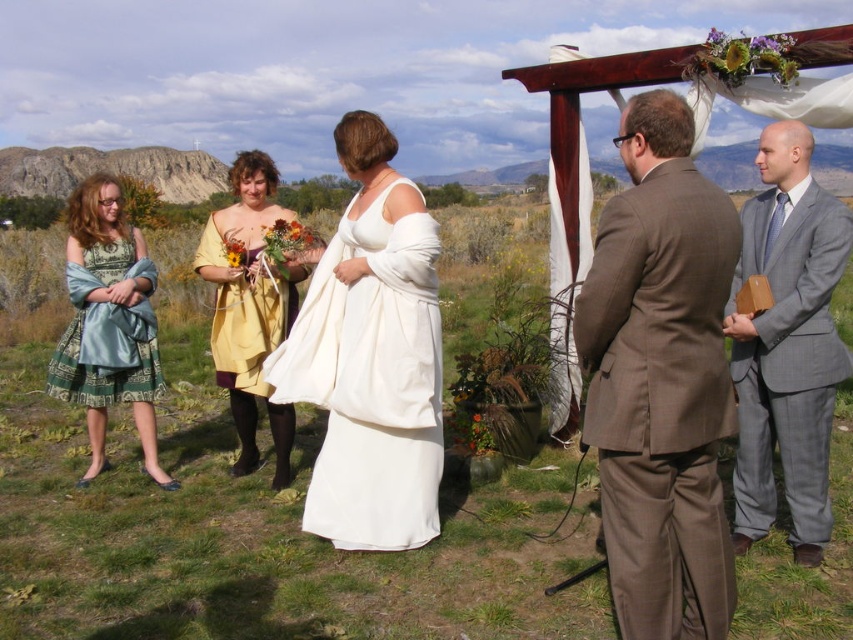
Which is in front, point (247, 316) or point (245, 292)?

Point (245, 292) is more forward.

Does matte yellow dress at center have a greater height compared to yellow satin dress at center?

Indeed, matte yellow dress at center has a greater height compared to yellow satin dress at center.

Who is more distant from viewer, (x=277, y=429) or (x=241, y=376)?

Point (x=277, y=429)

The height and width of the screenshot is (640, 853). I want to click on matte yellow dress at center, so click(248, 292).

Is matte yellow dress at center below silky teal dress at left?

No, matte yellow dress at center is not below silky teal dress at left.

Find the location of `matte yellow dress at center`. matte yellow dress at center is located at coordinates (248, 292).

The width and height of the screenshot is (853, 640). In order to click on matte yellow dress at center in this screenshot , I will do `click(248, 292)`.

Is brown wool suit at center below green satin dress at left?

Indeed, brown wool suit at center is positioned under green satin dress at left.

Describe the element at coordinates (660, 378) in the screenshot. The image size is (853, 640). I see `brown wool suit at center` at that location.

What do you see at coordinates (660, 378) in the screenshot? I see `brown wool suit at center` at bounding box center [660, 378].

Identify the location of brown wool suit at center. The image size is (853, 640). (660, 378).